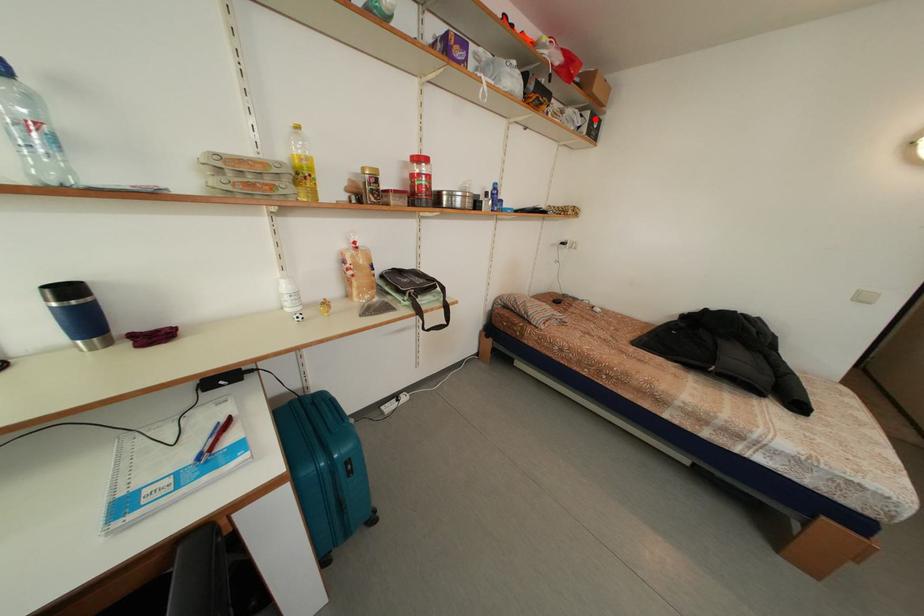
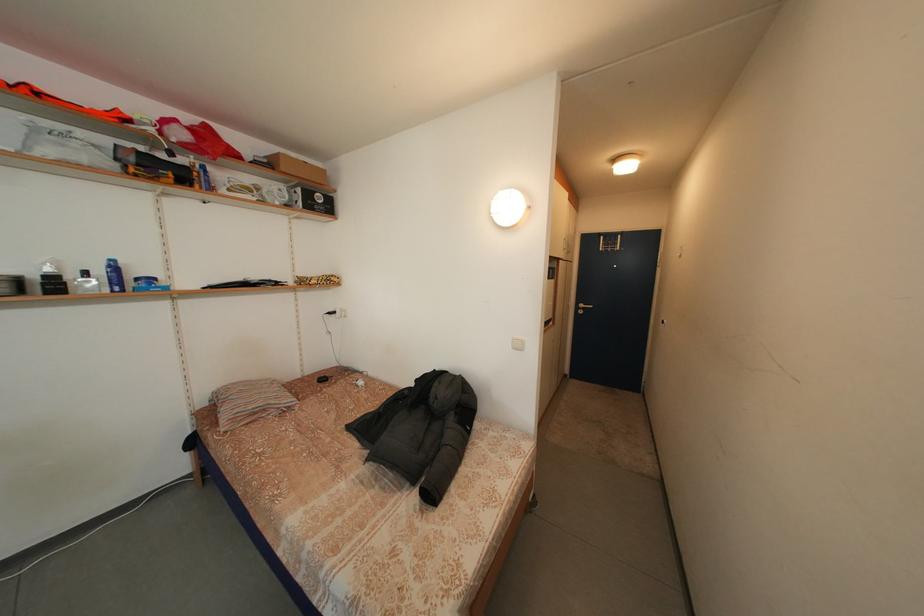
Question: I am providing you with two images of the same scene from different viewpoints. A red point is marked on the first image. Can you still see the location of the red point in image 2?

Choices:
 (A) Yes
 (B) No

Answer: (A)